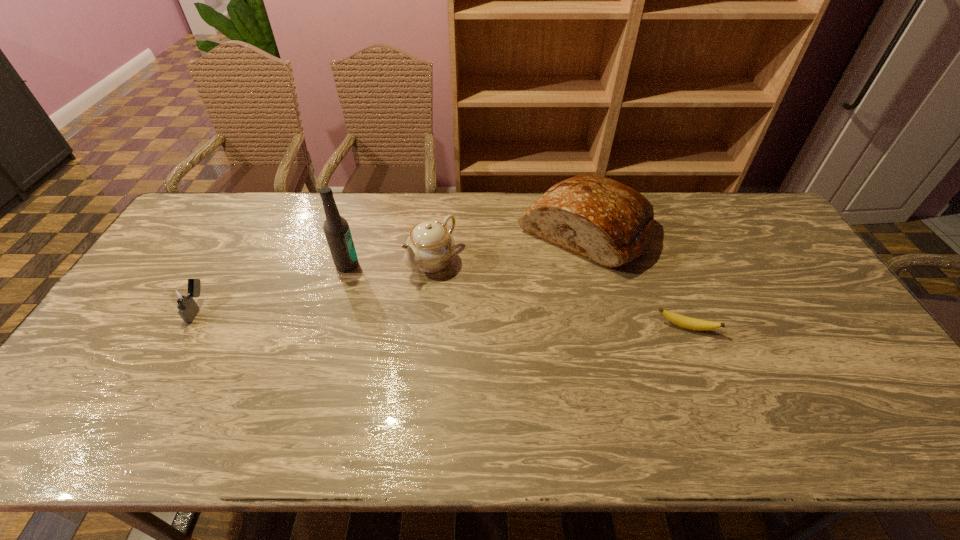
Find the location of a particular element. free spot on the desktop that is between the second shortest object and the shortest object and is positioned at the sliced front of the bread is located at coordinates (485, 319).

Locate an element on the screen. The width and height of the screenshot is (960, 540). vacant spot on the desktop that is between the leftmost object and the shortest object and is positioned at the spout of the chinaware is located at coordinates (367, 315).

At what (x,y) coordinates should I click in order to perform the action: click on vacant space on the desktop that is between the second shortest object and the banana and is positioned on the side of the beer bottle with the label. Please return your answer as a coordinate pair (x, y). This screenshot has width=960, height=540. Looking at the image, I should click on (430, 317).